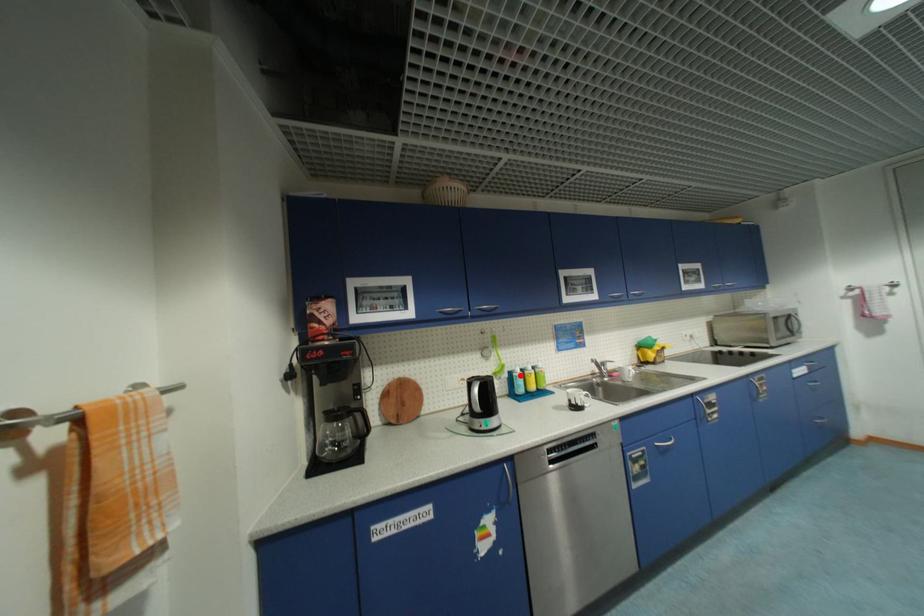
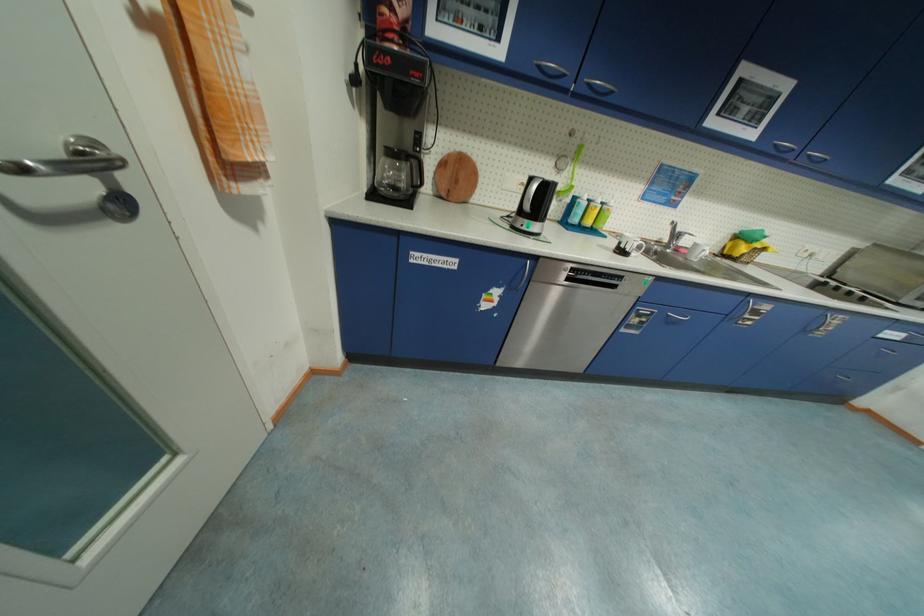
Question: I am providing you with two images of the same scene from different viewpoints. A red point is shown in image1. For the corresponding object point in image2, is it positioned nearer or farther from the camera?

Choices:
 (A) Nearer
 (B) Farther

Answer: (A)